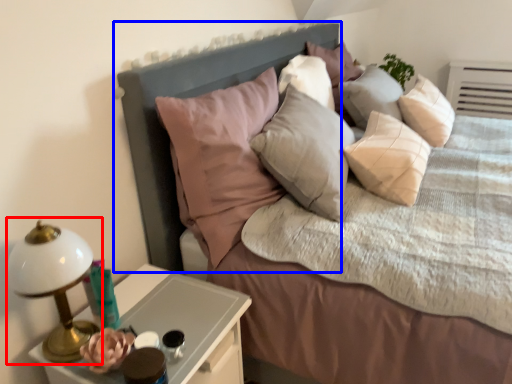
Question: Which object appears farthest to the camera in this image, bedside lamp (highlighted by a red box) or headboard (highlighted by a blue box)?

Choices:
 (A) bedside lamp
 (B) headboard

Answer: (B)